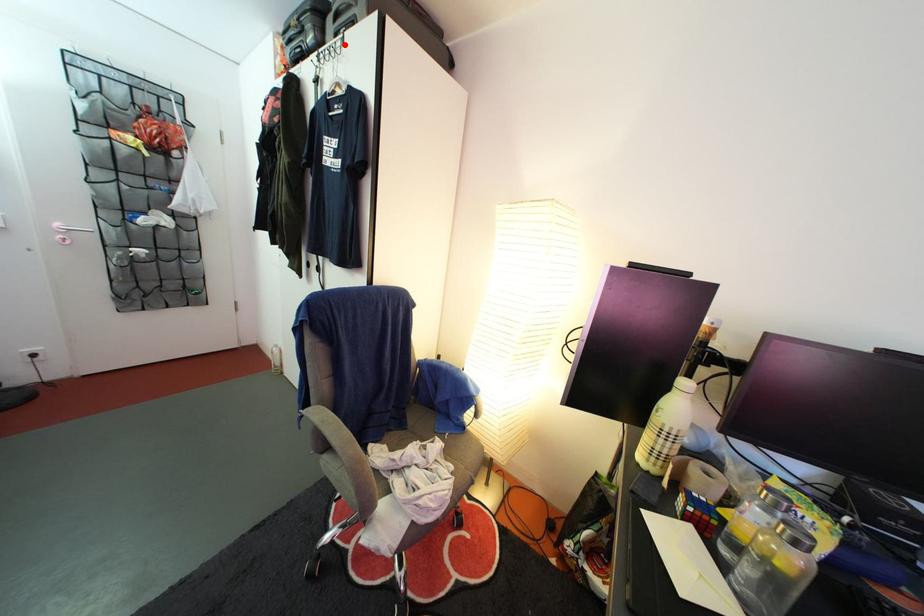
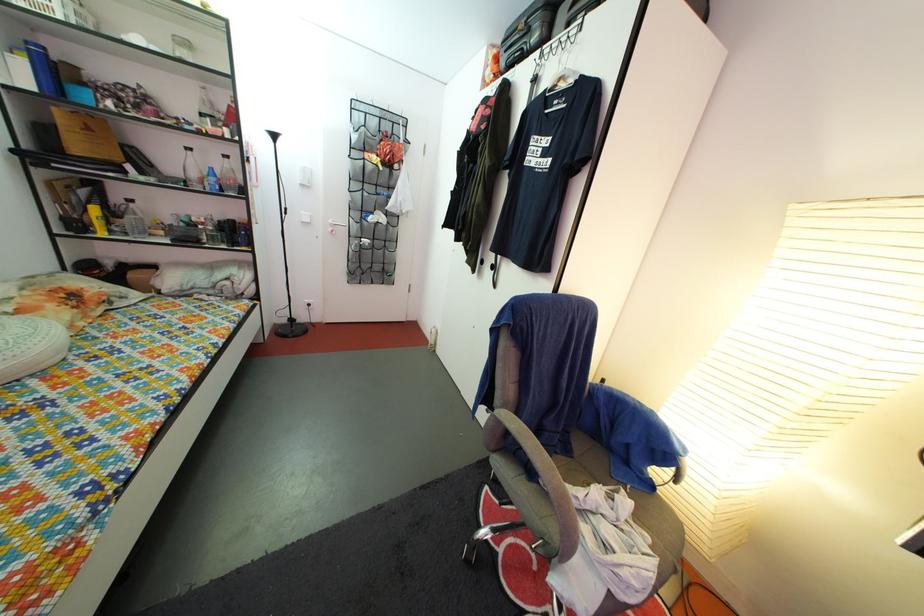
Locate, in the second image, the point that corresponds to the highlighted location in the first image.

(578, 31)